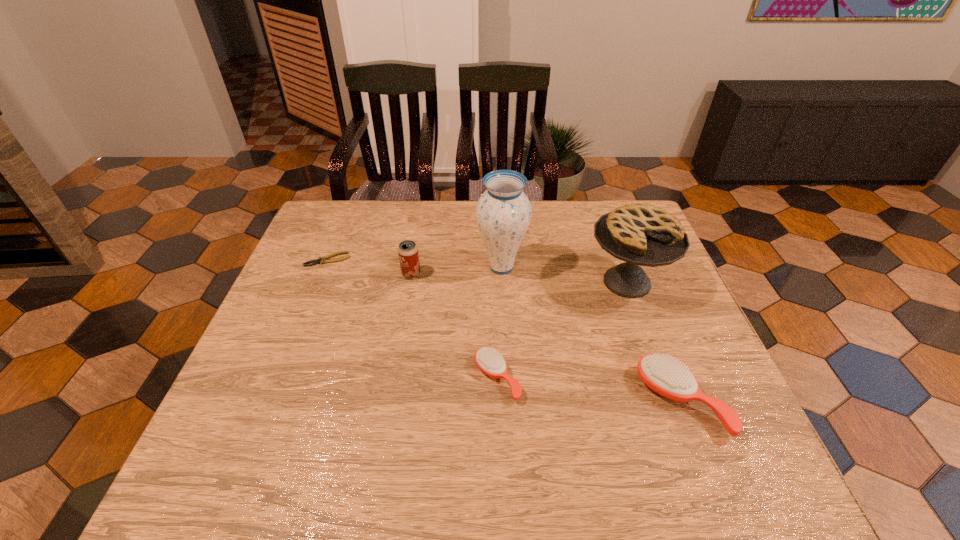
At what (x,y) coordinates should I click in order to perform the action: click on vacant space at the far edge. Please return your answer as a coordinate pair (x, y). The width and height of the screenshot is (960, 540). Looking at the image, I should click on (434, 217).

In the image, there is a desktop. At what (x,y) coordinates should I click in order to perform the action: click on vacant space at the near edge. Please return your answer as a coordinate pair (x, y). Looking at the image, I should click on (480, 419).

Locate an element on the screen. vacant region at the left edge of the desktop is located at coordinates (353, 247).

Locate an element on the screen. free space at the right edge of the desktop is located at coordinates (668, 271).

Where is `vacant space at the near right corner of the desktop`? vacant space at the near right corner of the desktop is located at coordinates (737, 410).

Where is `free spot between the third shortest object and the tallest object`? The height and width of the screenshot is (540, 960). free spot between the third shortest object and the tallest object is located at coordinates (591, 334).

Locate an element on the screen. This screenshot has width=960, height=540. unoccupied position between the taller hairbrush and the pliers is located at coordinates (505, 330).

Image resolution: width=960 pixels, height=540 pixels. Find the location of `free point between the third tallest object and the leftmost object`. free point between the third tallest object and the leftmost object is located at coordinates (370, 267).

The height and width of the screenshot is (540, 960). Identify the location of unoccupied position between the fifth object from right to left and the right hairbrush. (546, 338).

Where is `blank region between the leftmost object and the fifth shortest object`? The width and height of the screenshot is (960, 540). blank region between the leftmost object and the fifth shortest object is located at coordinates (477, 271).